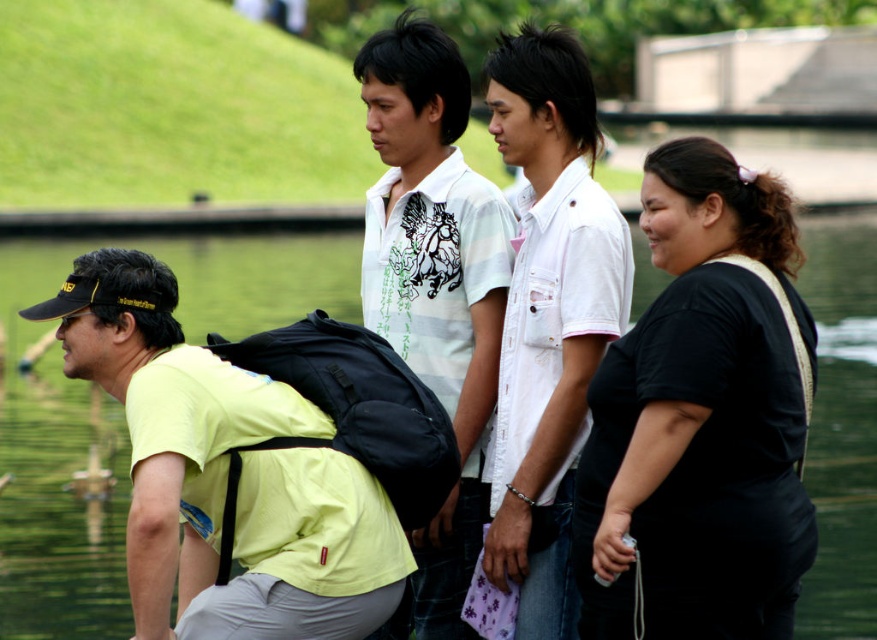
Image resolution: width=877 pixels, height=640 pixels. Describe the element at coordinates (701, 419) in the screenshot. I see `black matte shirt at right` at that location.

Is black matte shirt at right smaller than green water at center?

Yes.

I want to click on black matte shirt at right, so click(x=701, y=419).

Locate an element on the screen. The height and width of the screenshot is (640, 877). black matte shirt at right is located at coordinates (701, 419).

Can you confirm if black matte shirt at right is bigger than yellow matte shirt at left?

No.

Image resolution: width=877 pixels, height=640 pixels. I want to click on black matte shirt at right, so click(701, 419).

Is black matte shirt at right closer to camera compared to white striped polo shirt at center?

No, it is behind white striped polo shirt at center.

Does point (707, 369) come farther from viewer compared to point (374, 216)?

That is False.

This screenshot has width=877, height=640. What are the coordinates of `black matte shirt at right` in the screenshot? It's located at (701, 419).